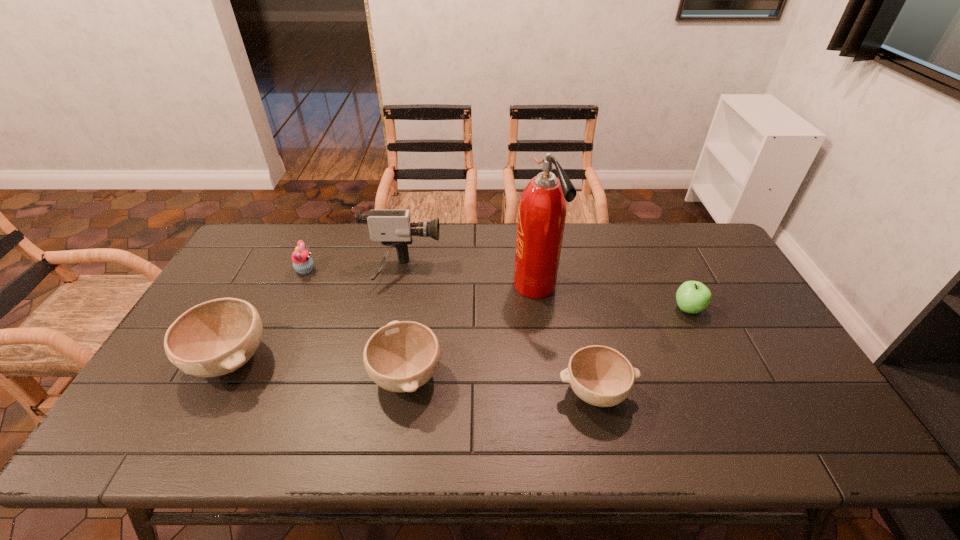
The width and height of the screenshot is (960, 540). Find the location of `the leftmost bowl`. the leftmost bowl is located at coordinates (214, 338).

Find the location of a particular element. This screenshot has width=960, height=540. the second tallest bowl is located at coordinates (402, 356).

Locate an element on the screen. The height and width of the screenshot is (540, 960). the rightmost bowl is located at coordinates (601, 376).

Find the location of a particular element. This screenshot has height=540, width=960. camcorder is located at coordinates (393, 228).

Locate an element on the screen. the tallest object is located at coordinates (542, 210).

Where is `cupcake`? This screenshot has width=960, height=540. cupcake is located at coordinates (302, 262).

Locate an element on the screen. the rightmost object is located at coordinates (692, 297).

Identify the location of free point located 0.220m on the right of the leftmost bowl. (354, 360).

Locate an element on the screen. This screenshot has height=540, width=960. vacant area situated 0.150m on the right of the second bowl from left to right is located at coordinates (501, 375).

Find the location of a particular element. vacant area situated on the back of the shortest bowl is located at coordinates (568, 275).